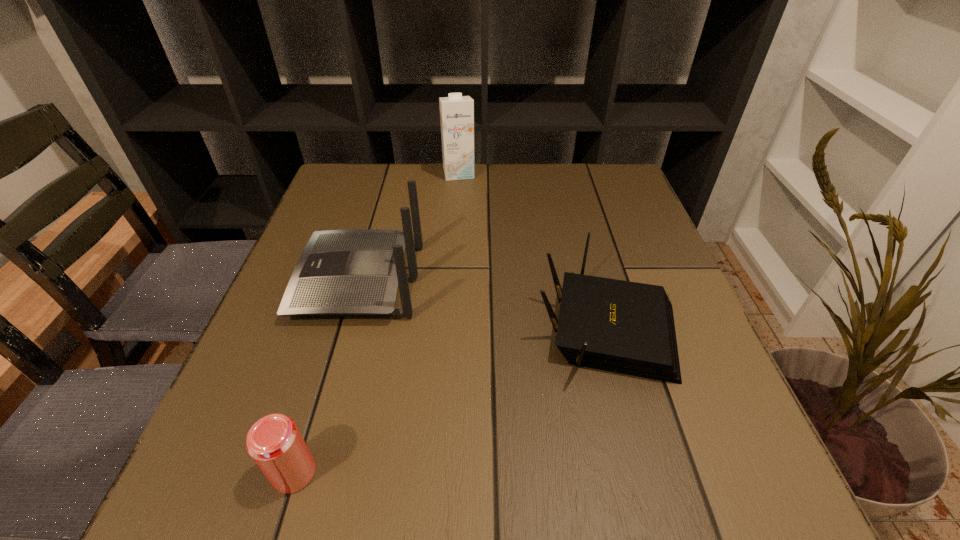
Find the location of `object positioned at the far edge`. object positioned at the far edge is located at coordinates click(456, 111).

This screenshot has width=960, height=540. I want to click on object located at the near edge, so click(274, 442).

The height and width of the screenshot is (540, 960). I want to click on router located in the left edge section of the desktop, so click(356, 272).

In order to click on beer can that is at the left edge in this screenshot , I will do `click(274, 442)`.

This screenshot has height=540, width=960. In order to click on object positioned at the right edge in this screenshot , I will do `click(625, 327)`.

Identify the location of object at the near left corner. The width and height of the screenshot is (960, 540). (274, 442).

Where is `vacant space at the far edge of the desktop`? This screenshot has height=540, width=960. vacant space at the far edge of the desktop is located at coordinates (546, 181).

The height and width of the screenshot is (540, 960). I want to click on vacant space at the near edge of the desktop, so click(x=567, y=487).

Where is `vacant space at the left edge`? The width and height of the screenshot is (960, 540). vacant space at the left edge is located at coordinates (340, 212).

The height and width of the screenshot is (540, 960). I want to click on vacant area at the right edge, so click(643, 235).